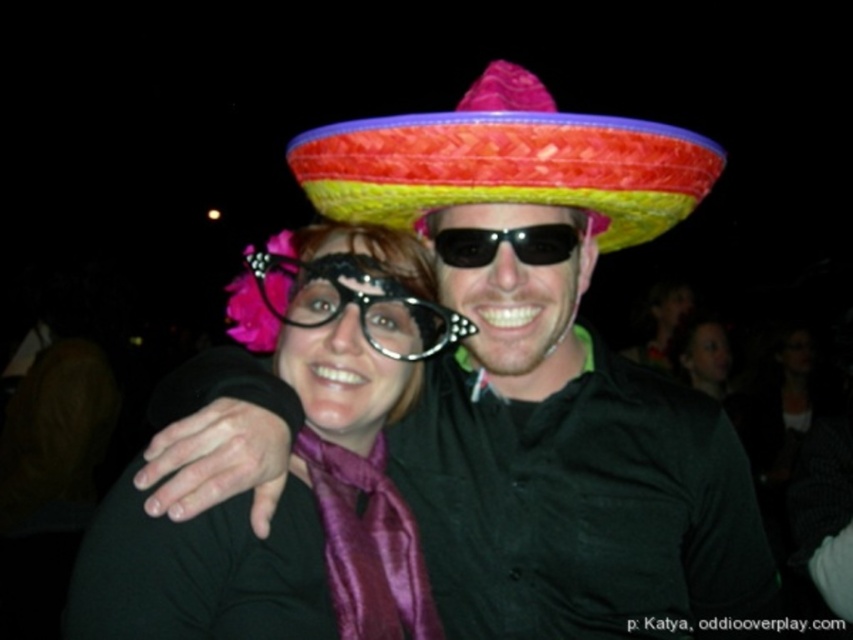
You are at a party and want to take a photo with both the person wearing oversized black glasses with pink flowers and the person in a colorful sombrero. You need to position yourself so that you are closer to the person in the colorful sombrero than to the other person. Based on their positions at coordinates point (537,104) and point (308,323) respectively, which coordinate should you stand closer to?

You should stand closer to point (308,323) because point (537,104) is behind point (308,323), meaning the distance to the sombrero person is shorter.

You are a photographer at the event and want to capture a closeup shot of both the multicolored woven sombrero at center and the black plastic glasses at center in the same frame. Given the camera lens you have can only focus on objects within 8 inches of each other, will you be able to take the photo without moving either object?

The multicolored woven sombrero at center is 8.15 inches away from the black plastic glasses at center. Since the distance between them exceeds the camera lens focus range of 8 inches, you will need to move one of the objects closer to ensure they are within the 8 inch range for clear focus.